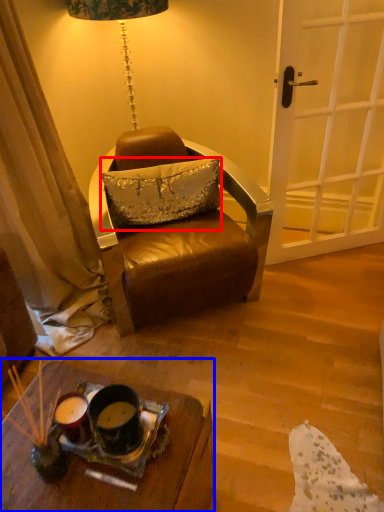
Question: Which object is further to the camera taking this photo, pillow (highlighted by a red box) or desk (highlighted by a blue box)?

Choices:
 (A) pillow
 (B) desk

Answer: (A)